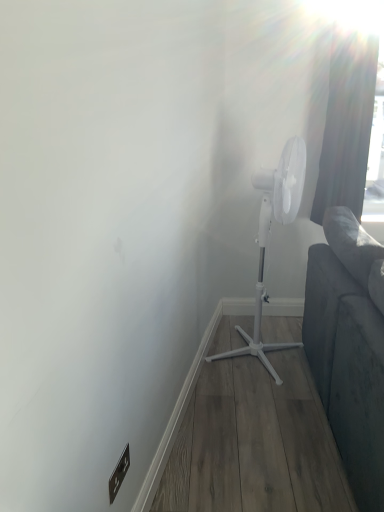
Question: Is brown matte electric outlet at lower left to the left or to the right of white plastic mechanical fan at center in the image?

Choices:
 (A) right
 (B) left

Answer: (B)

Question: Is point (122, 474) closer or farther from the camera than point (254, 343)?

Choices:
 (A) closer
 (B) farther

Answer: (A)

Question: Which object is positioned closest to the dark gray fabric curtain at upper right?

Choices:
 (A) white plastic mechanical fan at center
 (B) brown matte electric outlet at lower left

Answer: (A)

Question: Estimate the real-world distances between objects in this image. Which object is farther from the white plastic mechanical fan at center?

Choices:
 (A) dark gray fabric curtain at upper right
 (B) brown matte electric outlet at lower left

Answer: (B)